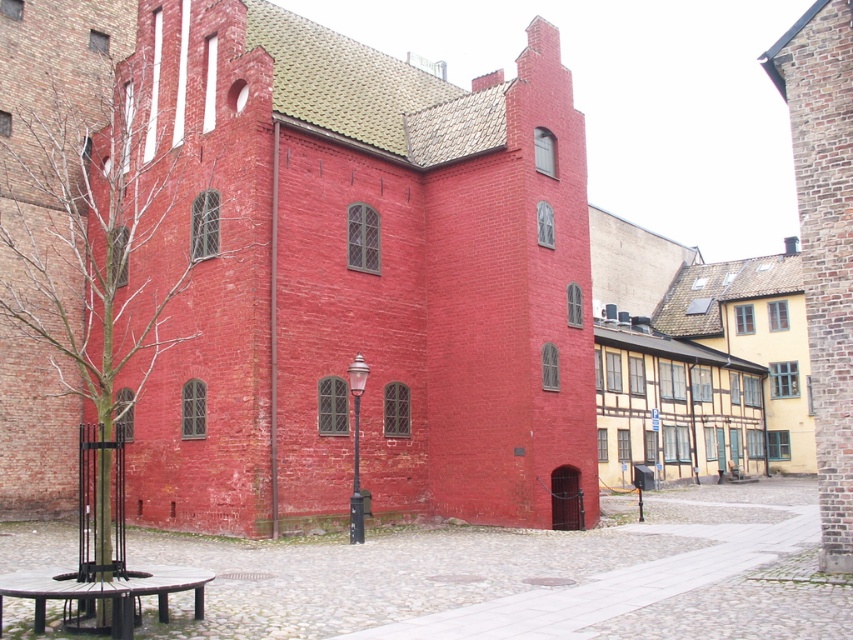
You are planning to host a small gathering in the courtyard of the brick textured church at center. You need to place the black polished stone picnic table at lower left near the entrance. Considering the space, which object occupies more horizontal space?

The brick textured church at center might be wider than the black polished stone picnic table at lower left, so it likely occupies more horizontal space.

You are standing in the courtyard looking at the red brick building. There are two points marked on the ground in front of you. The first point is at coordinates point (467, 465) and the second is at point (68, 582). Which point is closer to your current position?

Point (68, 582) is closer to your current position because it is closer to the viewer than point (467, 465), which is further away.

You are standing in the courtyard of the brick textured church at center. If you face the building, which direction should you walk to reach the black lamppost located near the center?

The brick textured church at center is located at point (367, 282), so the black lamppost is near the center of the courtyard. Since you are facing the building, you should walk forward towards the center of the courtyard to reach the black lamppost.